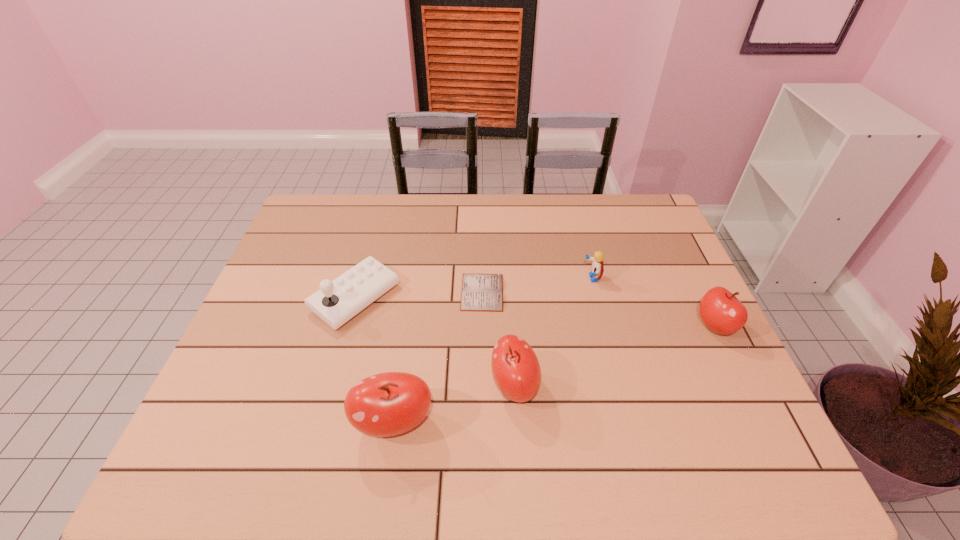
Identify the location of free spot that satisfies the following two spatial constraints: 1. on the back side of the leftmost apple; 2. on the left side of the fifth shortest object. (399, 386).

Where is `blank space that satisfies the following two spatial constraints: 1. on the front side of the joystick; 2. on the left side of the second tallest object`? blank space that satisfies the following two spatial constraints: 1. on the front side of the joystick; 2. on the left side of the second tallest object is located at coordinates (331, 386).

At what (x,y) coordinates should I click in order to perform the action: click on vacant region that satisfies the following two spatial constraints: 1. on the front-facing side of the second object from right to left; 2. on the front side of the second apple from right to left. Please return your answer as a coordinate pair (x, y). The image size is (960, 540). Looking at the image, I should click on (620, 386).